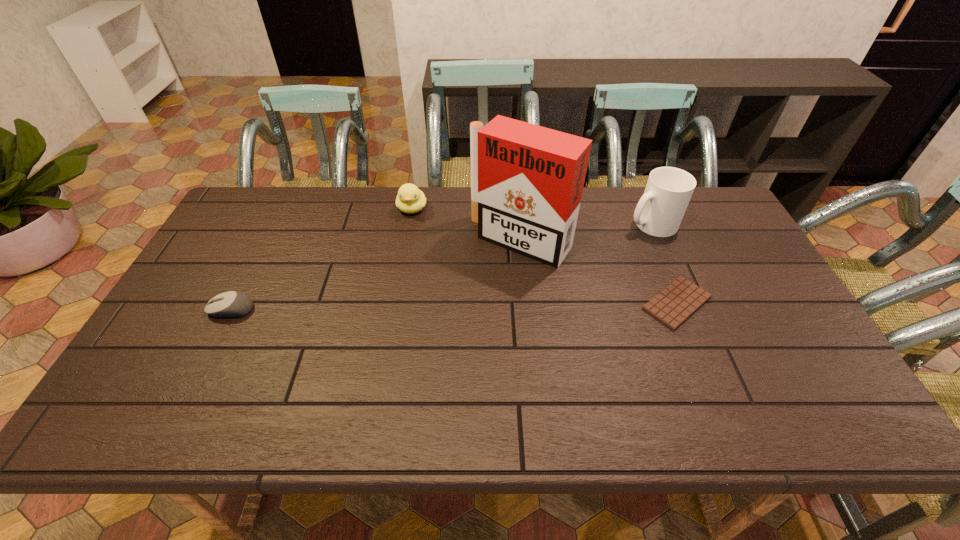
Where is `free space between the tallest object and the computer equipment`? This screenshot has height=540, width=960. free space between the tallest object and the computer equipment is located at coordinates (376, 275).

Locate an element on the screen. free space between the cigarette case and the duckling is located at coordinates (467, 225).

This screenshot has width=960, height=540. Find the location of `free space between the fourth shortest object and the chocolate bar`. free space between the fourth shortest object and the chocolate bar is located at coordinates (664, 264).

Choose which object is the second nearest neighbor to the chocolate bar. Please provide its 2D coordinates. Your answer should be formatted as a tuple, i.e. [(x, y)], where the tuple contains the x and y coordinates of a point satisfying the conditions above.

[(659, 212)]

At what (x,y) coordinates should I click in order to perform the action: click on the closest object to the third object from left to right. Please return your answer as a coordinate pair (x, y). The height and width of the screenshot is (540, 960). Looking at the image, I should click on click(x=410, y=199).

The width and height of the screenshot is (960, 540). I want to click on free location that satisfies the following two spatial constraints: 1. on the back side of the second tallest object; 2. on the right side of the tallest object, so click(519, 224).